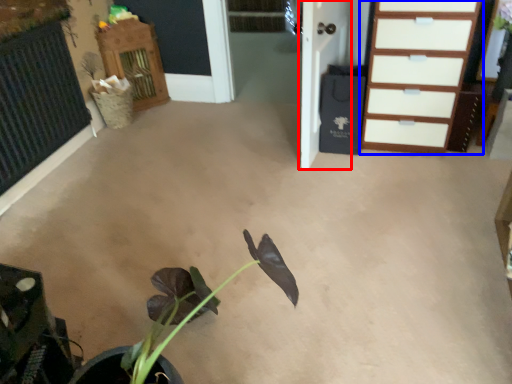
Question: Which object is closer to the camera taking this photo, door (highlighted by a red box) or chest of drawers (highlighted by a blue box)?

Choices:
 (A) door
 (B) chest of drawers

Answer: (A)